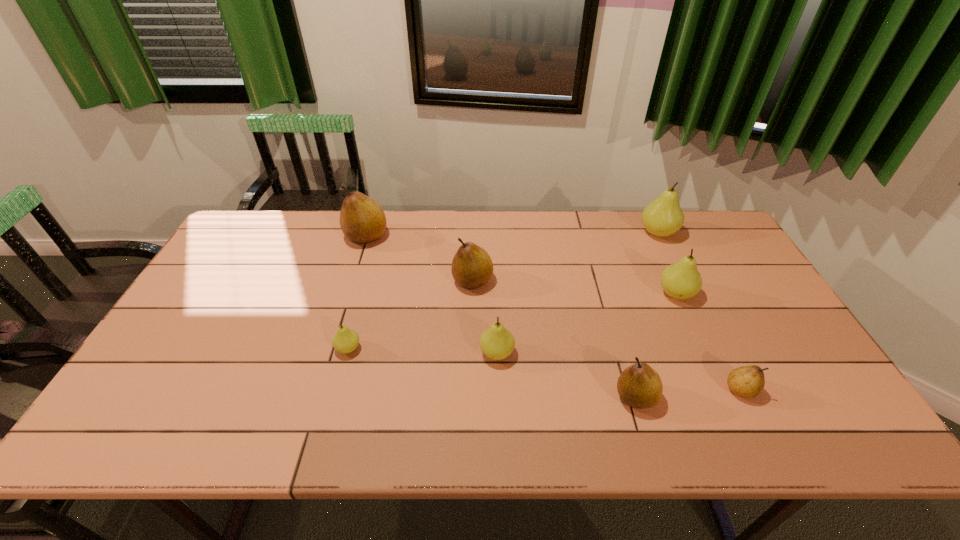
The height and width of the screenshot is (540, 960). In order to click on free space between the third green pear from right to left and the third brown pear from right to left in this screenshot , I will do click(485, 317).

What are the coordinates of `unoccupied area between the leftmost brown pear and the second farthest green pear` in the screenshot? It's located at (521, 265).

You are a GUI agent. You are given a task and a screenshot of the screen. Output one action in this format:
    pyautogui.click(x=<x>, y=<y>)
    Task: Click on the free space between the biggest brown pear and the second biggest brown pear
    This screenshot has width=960, height=540.
    Given the screenshot: What is the action you would take?
    pyautogui.click(x=420, y=259)

The width and height of the screenshot is (960, 540). In order to click on free space between the third brown pear from right to left and the farthest brown pear in this screenshot , I will do `click(420, 259)`.

In order to click on free space between the leftmost green pear and the second smallest green pear in this screenshot , I will do `click(422, 351)`.

I want to click on free space between the second green pear from left to right and the third brown pear from right to left, so click(485, 317).

The width and height of the screenshot is (960, 540). Identify the location of object that is the fifth closest to the second farthest green pear. (472, 267).

Image resolution: width=960 pixels, height=540 pixels. What are the coordinates of `the fifth closest object to the smallest brown pear` in the screenshot? It's located at (472, 267).

Point out which pear is positioned as the third nearest to the third smallest green pear. Please provide its 2D coordinates. Your answer should be formatted as a tuple, i.e. [(x, y)], where the tuple contains the x and y coordinates of a point satisfying the conditions above.

[(639, 386)]

In order to click on pear that is the seventh closest to the leftmost brown pear in this screenshot , I will do `click(747, 381)`.